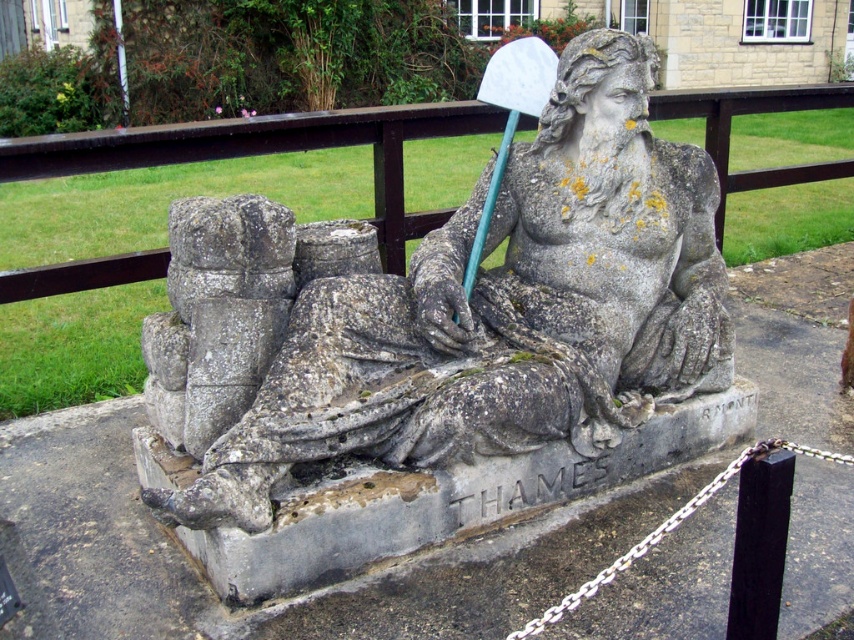
Question: Does stone statue at center appear on the right side of green plastic shovel at upper center?

Choices:
 (A) yes
 (B) no

Answer: (B)

Question: Is stone statue at center to the left of green plastic shovel at upper center from the viewer's perspective?

Choices:
 (A) yes
 (B) no

Answer: (A)

Question: Which point is closer to the camera taking this photo?

Choices:
 (A) (506, 131)
 (B) (218, 518)

Answer: (B)

Question: Which object is closer to the camera taking this photo?

Choices:
 (A) stone statue at center
 (B) green plastic shovel at upper center

Answer: (A)

Question: Can you confirm if stone statue at center is smaller than green plastic shovel at upper center?

Choices:
 (A) no
 (B) yes

Answer: (A)